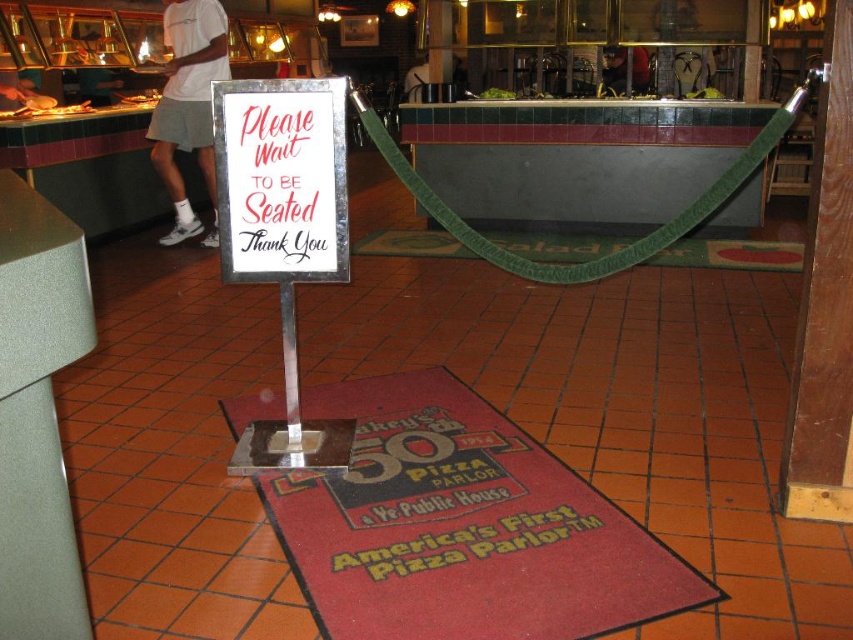
In the scene shown: Is red rubber mat at center above green fabric rope at center?

Actually, red rubber mat at center is below green fabric rope at center.

Between red rubber mat at center and green fabric rope at center, which one has more height?

red rubber mat at center is taller.

Does point (445, 406) come behind point (402, 243)?

No, (445, 406) is closer to viewer.

At what (x,y) coordinates should I click in order to perform the action: click on red rubber mat at center. Please return your answer as a coordinate pair (x, y). Looking at the image, I should click on (461, 525).

Can you confirm if matte gray pillar at center left is positioned to the left of green fabric rope at center?

Correct, you'll find matte gray pillar at center left to the left of green fabric rope at center.

Can you confirm if matte gray pillar at center left is taller than green fabric rope at center?

Correct, matte gray pillar at center left is much taller as green fabric rope at center.

Who is more forward, (32, 513) or (798, 262)?

Point (32, 513) is more forward.

I want to click on matte gray pillar at center left, so click(38, 413).

Can you confirm if wooden at center is bigger than green fabric rope at center?

Incorrect, wooden at center is not larger than green fabric rope at center.

Where is `wooden at center`? This screenshot has width=853, height=640. wooden at center is located at coordinates (825, 305).